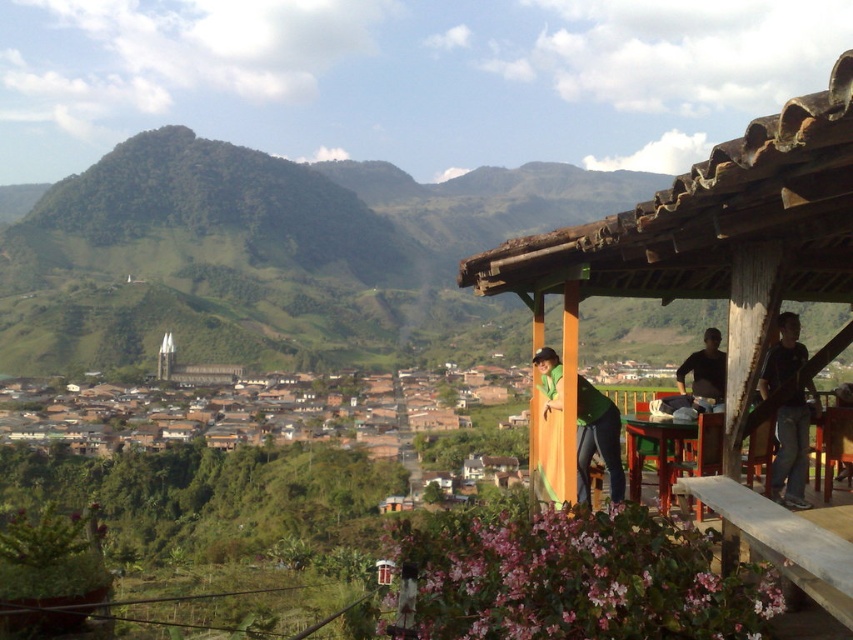
Question: Which object is the closest to the black matte shirt at upper right?

Choices:
 (A) green matte shirt at center
 (B) dark blue jeans at right

Answer: (B)

Question: Does wooden gazebo at upper right appear on the right side of green matte shirt at center?

Choices:
 (A) yes
 (B) no

Answer: (A)

Question: Can you confirm if wooden gazebo at upper right is bigger than green matte shirt at center?

Choices:
 (A) yes
 (B) no

Answer: (A)

Question: Can you confirm if wooden gazebo at upper right is smaller than dark blue jeans at right?

Choices:
 (A) no
 (B) yes

Answer: (A)

Question: Which point is closer to the camera?

Choices:
 (A) (674, 400)
 (B) (758, 164)
 (C) (596, 433)

Answer: (B)

Question: Among these points, which one is farthest from the camera?

Choices:
 (A) (724, 358)
 (B) (833, 195)
 (C) (802, 348)
 (D) (589, 416)

Answer: (A)